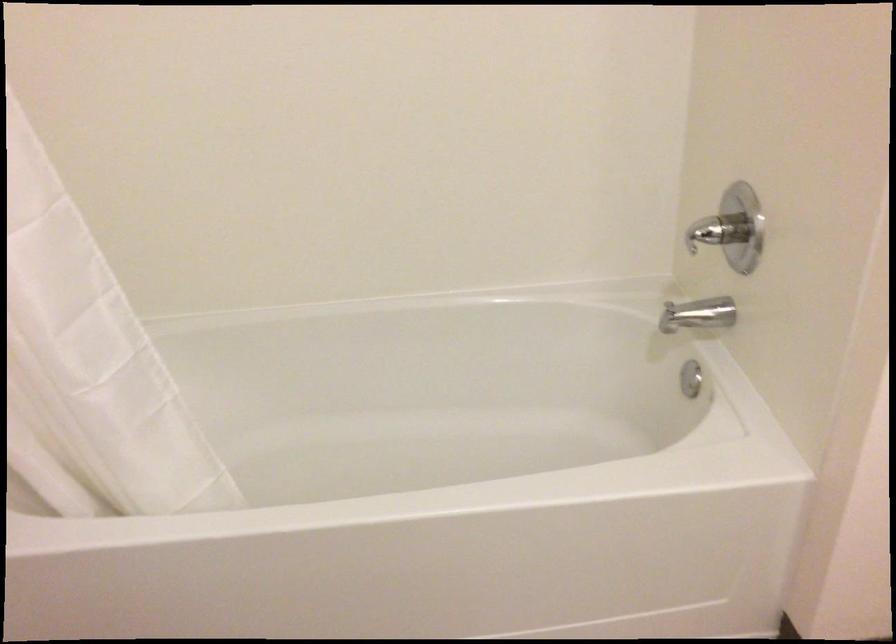
Find where to turn the chrome shower handle. Please return your answer as a coordinate pair (x, y).

(698, 315)